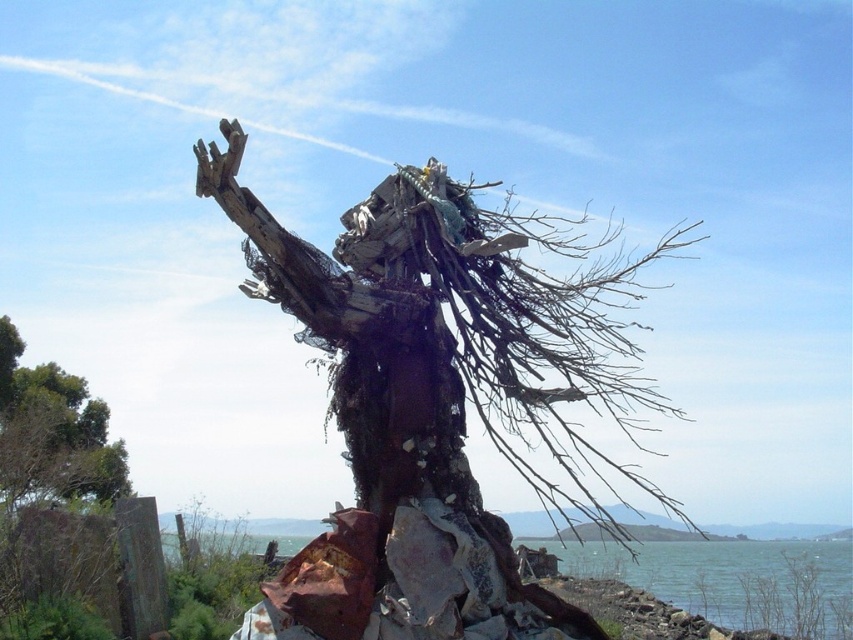
You are a photographer planning to capture the rusty metal sculpture at center and the blue water at lower center in a single frame. Based on their positions, can you determine if the sculpture is placed in front of or behind the blue water?

The rusty metal sculpture at center is positioned over blue water at lower center, so the sculpture is placed in front of the blue water.

You are standing at the point indicated by point (436, 400) in the image. What object are you facing?

The point (436, 400) indicates rusty metal sculpture at center, so you are facing the rusty metal sculpture at center.

You are standing in front of the structure and want to determine the relative positions of two points on it. Which of the two points, point (338, 372) or point (647, 550), is closer to you?

Point (338, 372) is closer to the viewer than point (647, 550).